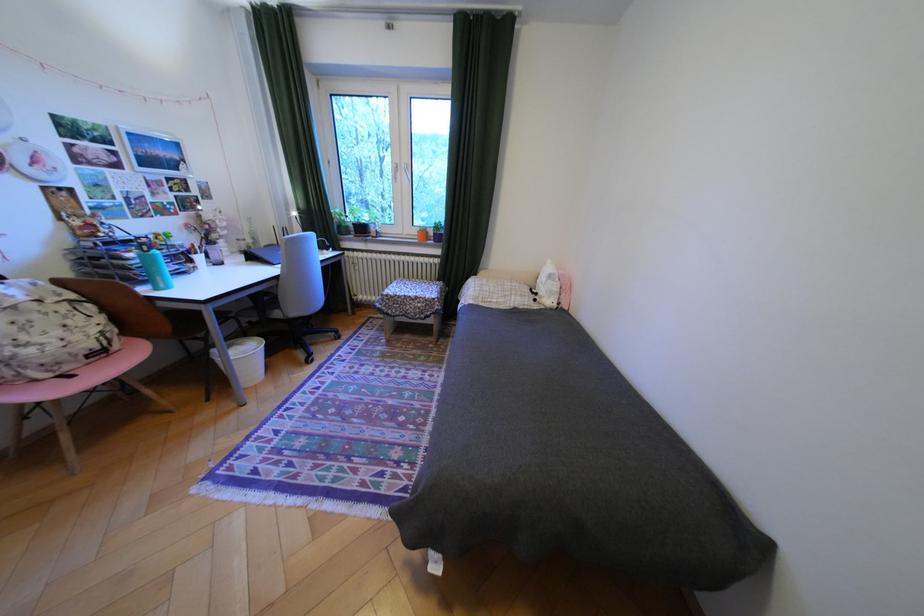
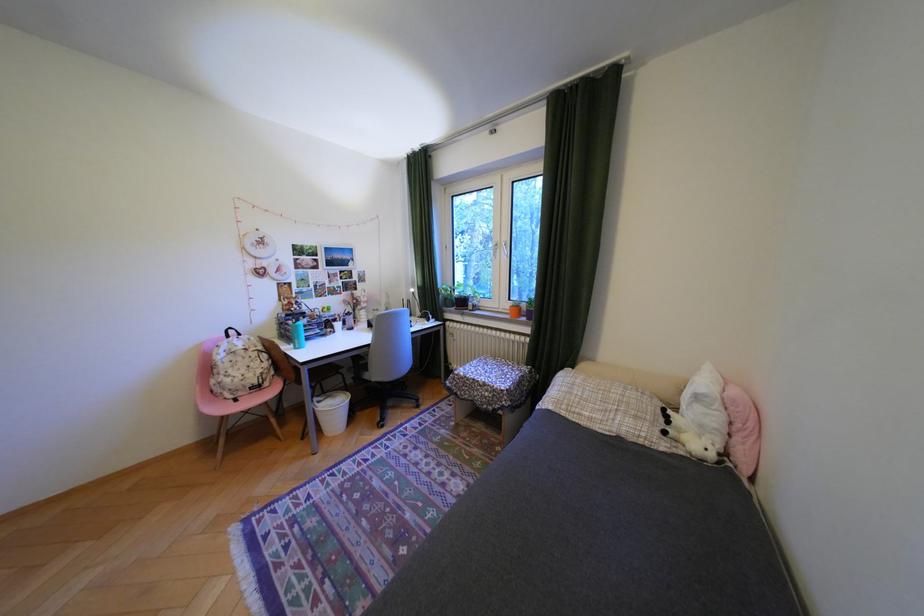
Question: The camera is either moving clockwise (left) or counter-clockwise (right) around the object. The first image is from the beginning of the video and the second image is from the end. Is the camera moving left or right when shooting the video?

Choices:
 (A) Left
 (B) Right

Answer: (B)